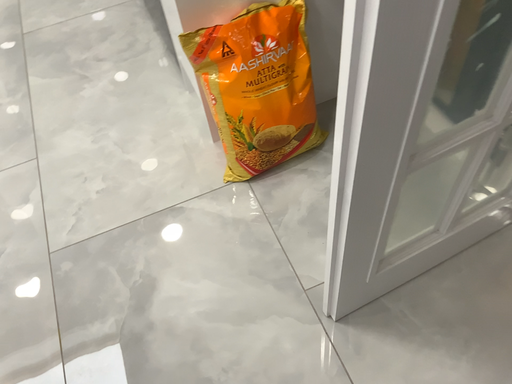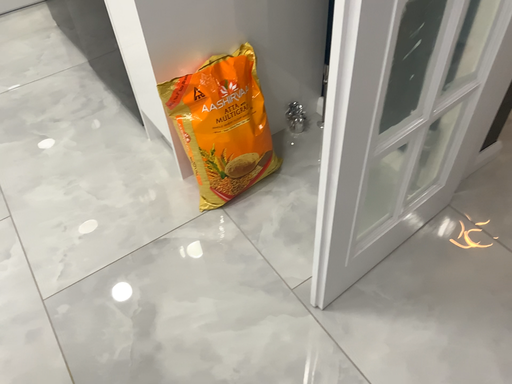
Question: How did the camera likely rotate when shooting the video?

Choices:
 (A) rotated downward
 (B) rotated upward

Answer: (B)